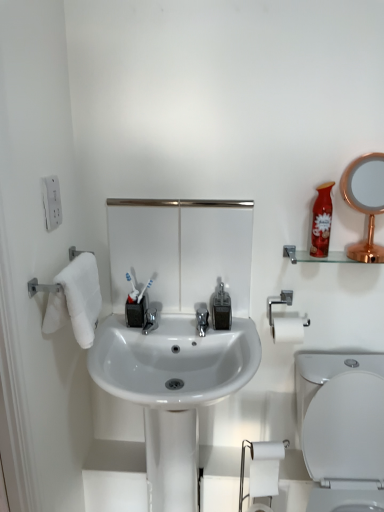
Where is `free location above clear glass shelf at upper right (from a real-world perspective)`? free location above clear glass shelf at upper right (from a real-world perspective) is located at coordinates (339, 250).